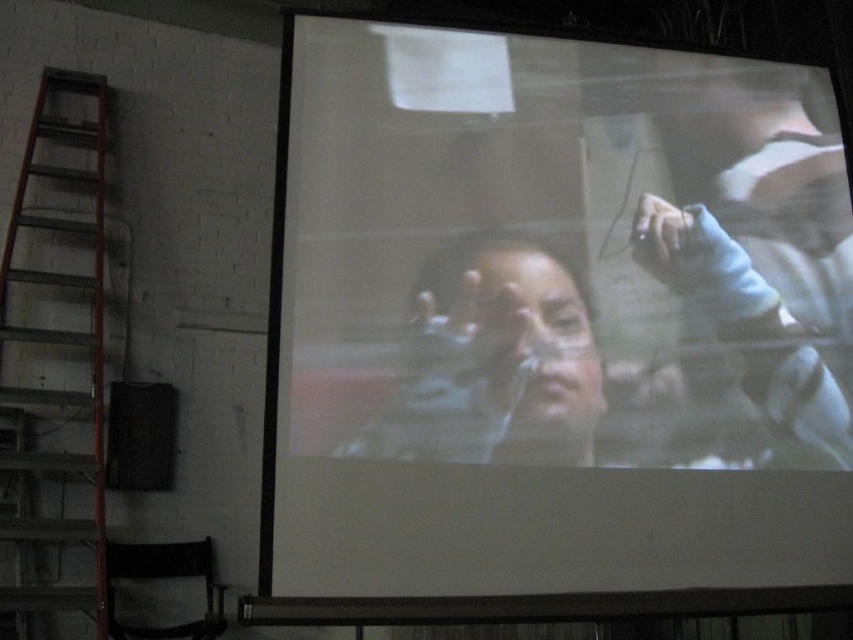
You are an event organizer setting up for a film screening. You need to place a new speaker system between the white matte projection screen at center and the metallic orange ladder at left. Based on the scene, can you determine which side of the speaker system should face towards the audience?

The white matte projection screen at center is closer to the viewer than the metallic orange ladder at left, so the speaker system should be placed facing the audience towards the projection screen side to ensure optimal sound direction towards the audience.

You are an event coordinator setting up for a film screening. You need to ensure that the audience can clearly see both the smooth skin face at center and the metallic orange ladder at left. Based on their positions, which object should you adjust the screen brightness for to ensure visibility?

The smooth skin face at center is closer to the viewer than the metallic orange ladder at left. To ensure visibility of both objects, you should adjust the screen brightness to prioritize the smooth skin face at center since it is closer and may require more contrast to maintain detail.

You are a movie director analyzing the scene. You need to decide if the smooth skin face at center will fit within the frame of a camera that can capture up to the width of the metallic orange ladder at left. Based on the description, will it fit?

The smooth skin face at center might be wider than metallic orange ladder at left, so it might not fit within the camera frame designed for the ladder width.